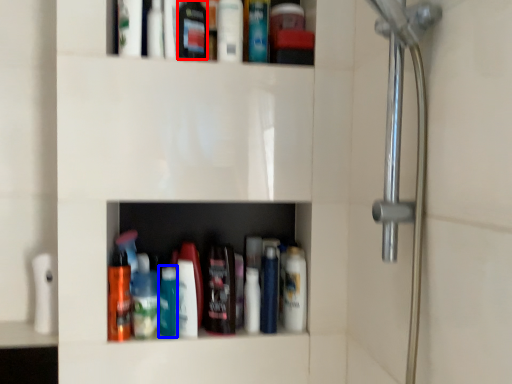
Question: Which object is closer to the camera taking this photo, mouthwash (highlighted by a red box) or bottle (highlighted by a blue box)?

Choices:
 (A) mouthwash
 (B) bottle

Answer: (A)